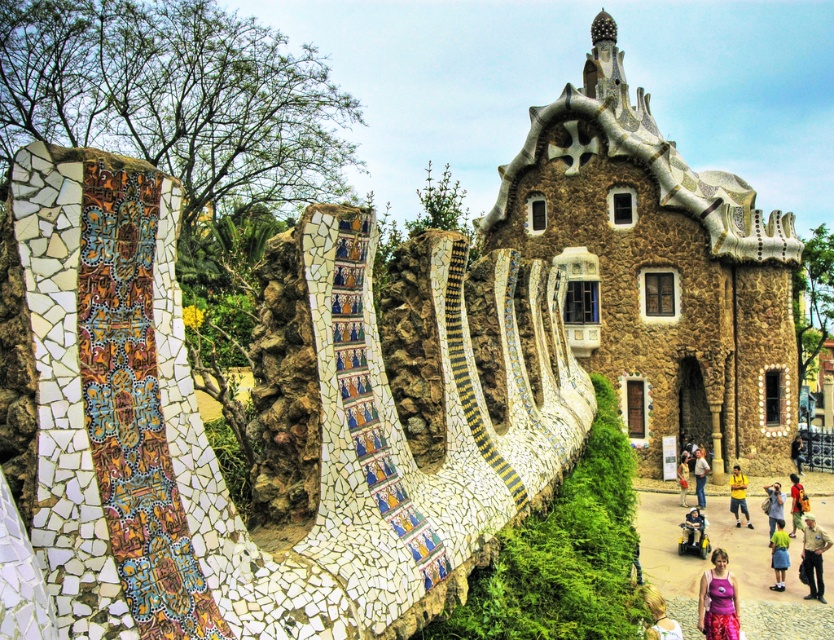
Between khaki uniform at lower right and light brown hair at lower center, which one appears on the right side from the viewer's perspective?

From the viewer's perspective, khaki uniform at lower right appears more on the right side.

Can you confirm if khaki uniform at lower right is positioned to the right of light brown hair at lower center?

Yes, khaki uniform at lower right is to the right of light brown hair at lower center.

Which is behind, point (804, 564) or point (672, 632)?

Positioned behind is point (804, 564).

I want to click on khaki uniform at lower right, so click(812, 556).

Is yellow fabric shorts at lower right to the right of light blue denim jeans at lower right from the viewer's perspective?

Incorrect, yellow fabric shorts at lower right is not on the right side of light blue denim jeans at lower right.

Between yellow fabric shorts at lower right and light blue denim jeans at lower right, which one appears on the left side from the viewer's perspective?

Positioned to the left is yellow fabric shorts at lower right.

Does point (774, 547) come farther from viewer compared to point (775, 492)?

No.

The height and width of the screenshot is (640, 834). Identify the location of yellow fabric shorts at lower right. (779, 554).

In the scene shown: Does brick cobblestone path at lower center have a greater width compared to khaki uniform at lower right?

Indeed, brick cobblestone path at lower center has a greater width compared to khaki uniform at lower right.

Between point (676, 529) and point (810, 534), which one is positioned in front?

Point (810, 534)

You are a GUI agent. You are given a task and a screenshot of the screen. Output one action in this format:
    pyautogui.click(x=<x>, y=<y>)
    Task: Click on the brick cobblestone path at lower center
    The width and height of the screenshot is (834, 640).
    Given the screenshot: What is the action you would take?
    pyautogui.click(x=767, y=579)